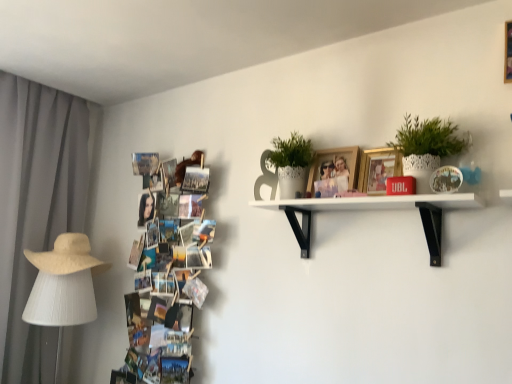
What is the approximate width of gold metallic picture frame at upper center, which is counted as the 2th picture frame, starting from the left?

gold metallic picture frame at upper center, which is counted as the 2th picture frame, starting from the left, is 2.44 inches in width.

This screenshot has height=384, width=512. I want to click on white textured pot at upper right, the first houseplant viewed from the front, so click(x=426, y=147).

Describe the element at coordinates (375, 209) in the screenshot. I see `white matte shelf at upper center` at that location.

You are a GUI agent. You are given a task and a screenshot of the screen. Output one action in this format:
    pyautogui.click(x=<x>, y=<y>)
    Task: Click on the beige straw hat at left
    
    Given the screenshot: What is the action you would take?
    pyautogui.click(x=67, y=256)

Locate an element on the screen. wooden photo frame at upper center, which is counted as the first picture frame, starting from the left is located at coordinates (335, 166).

The image size is (512, 384). Find the location of `gold metallic picture frame at upper center, which is counted as the 2th picture frame, starting from the left`. gold metallic picture frame at upper center, which is counted as the 2th picture frame, starting from the left is located at coordinates (378, 169).

Is gray fabric curtain at left far away from gold metallic picture frame at upper center, which is counted as the 2th picture frame, starting from the left?

That's right, there is a large distance between gray fabric curtain at left and gold metallic picture frame at upper center, which is counted as the 2th picture frame, starting from the left.

Can you confirm if gray fabric curtain at left is shorter than gold metallic picture frame at upper center, which is counted as the 2th picture frame, starting from the left?

No, gray fabric curtain at left is not shorter than gold metallic picture frame at upper center, which is counted as the 2th picture frame, starting from the left.

Does gray fabric curtain at left turn towards gold metallic picture frame at upper center, the first picture frame when ordered from right to left?

Yes, gray fabric curtain at left is oriented towards gold metallic picture frame at upper center, the first picture frame when ordered from right to left.

Which is more to the right, wooden photo frame at upper center, which appears as the 2th picture frame when viewed from the right, or printed paper collage at left?

wooden photo frame at upper center, which appears as the 2th picture frame when viewed from the right, is more to the right.

How much distance is there between wooden photo frame at upper center, which appears as the 2th picture frame when viewed from the right, and printed paper collage at left?

wooden photo frame at upper center, which appears as the 2th picture frame when viewed from the right, is 84.30 centimeters away from printed paper collage at left.

From the image's perspective, does wooden photo frame at upper center, which is counted as the first picture frame, starting from the left, appear higher than printed paper collage at left?

Yes, from the image's perspective, wooden photo frame at upper center, which is counted as the first picture frame, starting from the left, is over printed paper collage at left.

Does wooden photo frame at upper center, which appears as the 2th picture frame when viewed from the right, lie in front of printed paper collage at left?

Yes, wooden photo frame at upper center, which appears as the 2th picture frame when viewed from the right, is in front of printed paper collage at left.

Is the position of printed paper collage at left less distant than that of white matte shelf at upper center?

No, printed paper collage at left is further to the viewer.

Looking at this image, considering the relative sizes of printed paper collage at left and white matte shelf at upper center in the image provided, is printed paper collage at left smaller than white matte shelf at upper center?

No.

Are printed paper collage at left and white matte shelf at upper center located far from each other?

printed paper collage at left is near white matte shelf at upper center, not far away.

In terms of width, does printed paper collage at left look wider or thinner when compared to white matte shelf at upper center?

printed paper collage at left is thinner than white matte shelf at upper center.

Identify the location of straw hat located on the right of gray fabric curtain at left. (67, 256).

Looking at this image, from the image's perspective, which one is positioned lower, beige straw hat at left or gray fabric curtain at left?

From the image's view, beige straw hat at left is below.

How distant is beige straw hat at left from gray fabric curtain at left?

beige straw hat at left is 13.13 inches away from gray fabric curtain at left.

Does beige straw hat at left come in front of gray fabric curtain at left?

No.

From the image's perspective, which one is positioned higher, gold metallic picture frame at upper center, the first picture frame when ordered from right to left, or white textured pot at upper right, the second houseplant viewed from the left?

white textured pot at upper right, the second houseplant viewed from the left, from the image's perspective.

Is white textured pot at upper right, the first houseplant viewed from the front, located within gold metallic picture frame at upper center, the first picture frame when ordered from right to left?

No.

Could you measure the distance between gold metallic picture frame at upper center, the first picture frame when ordered from right to left, and white textured pot at upper right, the first houseplant viewed from the front?

4.06 inches.

Between point (379, 172) and point (453, 127), which one is positioned behind?

The point (379, 172) is more distant.

Is white fabric lampshade at left at the right side of beige straw hat at left?

No.

Is white fabric lampshade at left aimed at beige straw hat at left?

No, white fabric lampshade at left is not aimed at beige straw hat at left.

Can you confirm if white fabric lampshade at left is smaller than beige straw hat at left?

Actually, white fabric lampshade at left might be larger than beige straw hat at left.

Does white fabric lampshade at left touch beige straw hat at left?

No, white fabric lampshade at left is not touching beige straw hat at left.

From a real-world perspective, which is physically below, white textured pot at upper center, the second houseplant viewed from the front, or gray fabric curtain at left?

gray fabric curtain at left is physically lower.

Which point is more forward, (278, 178) or (15, 157)?

The point (278, 178) is more forward.

From the image's perspective, is white textured pot at upper center, the second houseplant viewed from the front, located above or below gray fabric curtain at left?

Based on their image positions, white textured pot at upper center, the second houseplant viewed from the front, is located above gray fabric curtain at left.

Are white textured pot at upper center, the first houseplant positioned from the left, and gray fabric curtain at left beside each other?

white textured pot at upper center, the first houseplant positioned from the left, is not next to gray fabric curtain at left, and they're not touching.

Identify the location of curtain that is behind the gold metallic picture frame at upper center, which is counted as the 2th picture frame, starting from the left. This screenshot has width=512, height=384. pyautogui.click(x=36, y=209).

The image size is (512, 384). I want to click on magazine below the wooden photo frame at upper center, which appears as the 2th picture frame when viewed from the right (from the image's perspective), so click(167, 267).

When comparing their distances from printed paper collage at left, does gold metallic picture frame at upper center, which is counted as the 2th picture frame, starting from the left, or white textured pot at upper center, the second houseplant viewed from the front, seem closer?

Based on the image, white textured pot at upper center, the second houseplant viewed from the front, appears to be nearer to printed paper collage at left.

Which object lies nearer to the anchor point white matte shelf at upper center, wooden photo frame at upper center, which is counted as the first picture frame, starting from the left, or white fabric lampshade at left?

wooden photo frame at upper center, which is counted as the first picture frame, starting from the left, lies closer to white matte shelf at upper center than the other object.

When comparing their distances from printed paper collage at left, does gray fabric curtain at left or white fabric lampshade at left seem closer?

white fabric lampshade at left lies closer to printed paper collage at left than the other object.

Based on their spatial positions, is wooden photo frame at upper center, which appears as the 2th picture frame when viewed from the right, or white fabric lampshade at left closer to beige straw hat at left?

The object closer to beige straw hat at left is white fabric lampshade at left.

Based on their spatial positions, is white fabric lampshade at left or white matte shelf at upper center further from wooden photo frame at upper center, which appears as the 2th picture frame when viewed from the right?

Based on the image, white fabric lampshade at left appears to be further to wooden photo frame at upper center, which appears as the 2th picture frame when viewed from the right.

From the image, which object appears to be nearer to white matte shelf at upper center, gray fabric curtain at left or white textured pot at upper right, acting as the 1th houseplant starting from the right?

Based on the image, white textured pot at upper right, acting as the 1th houseplant starting from the right, appears to be nearer to white matte shelf at upper center.

From the image, which object appears to be farther from white textured pot at upper center, the first houseplant when ordered from back to front, beige straw hat at left or printed paper collage at left?

Based on the image, beige straw hat at left appears to be further to white textured pot at upper center, the first houseplant when ordered from back to front.

Estimate the real-world distances between objects in this image. Which object is closer to white fabric lampshade at left, gray fabric curtain at left or printed paper collage at left?

gray fabric curtain at left is positioned closer to the anchor white fabric lampshade at left.

This screenshot has height=384, width=512. I want to click on shelf between gray fabric curtain at left and white textured pot at upper right, acting as the 1th houseplant starting from the right, so click(x=375, y=209).

The height and width of the screenshot is (384, 512). Find the location of `houseplant located between white fabric lampshade at left and white matte shelf at upper center in the left-right direction`. houseplant located between white fabric lampshade at left and white matte shelf at upper center in the left-right direction is located at coordinates (291, 164).

This screenshot has width=512, height=384. What are the coordinates of `houseplant between printed paper collage at left and white matte shelf at upper center` in the screenshot? It's located at (291, 164).

Find the location of a particular element. Image resolution: width=512 pixels, height=384 pixels. magazine between beige straw hat at left and white matte shelf at upper center from left to right is located at coordinates (167, 267).